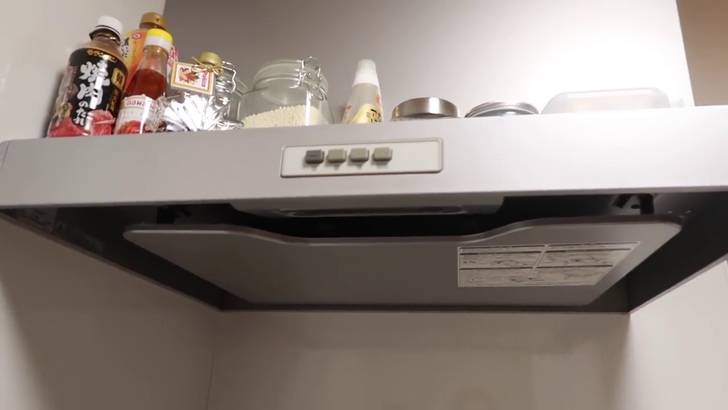
Image resolution: width=728 pixels, height=410 pixels. In order to click on shadow from shelf in this screenshot , I will do `click(52, 312)`.